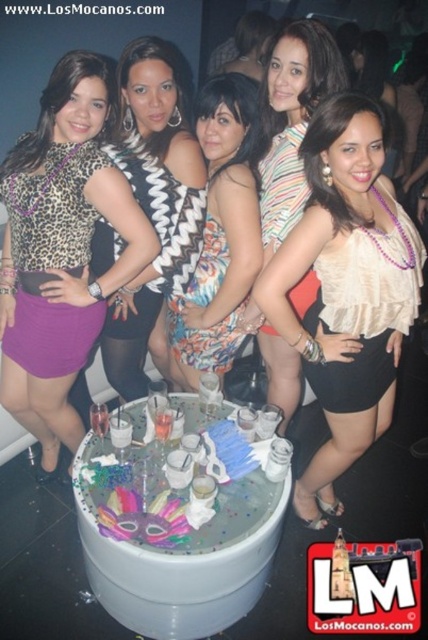
Identify the location of leopard print top at center. (62, 250).

Can you confirm if leopard print top at center is shorter than zigzag fabric dress at center?

No.

Is point (83, 120) closer to camera compared to point (181, 163)?

Yes, point (83, 120) is in front of point (181, 163).

Identify the location of leopard print top at center. (62, 250).

Who is positioned more to the right, white satin blouse at center or leopard print top at center?

Positioned to the right is white satin blouse at center.

Can you confirm if white satin blouse at center is thinner than leopard print top at center?

Yes.

Is point (341, 508) positioned in front of point (109, 170)?

No, it is not.

What are the coordinates of `white satin blouse at center` in the screenshot? It's located at (347, 289).

Is point (330, 99) positioned after point (145, 337)?

No, it is in front of (145, 337).

Who is positioned more to the left, white satin blouse at center or zigzag fabric dress at center?

zigzag fabric dress at center

Find the location of `white satin blouse at center`. white satin blouse at center is located at coordinates (347, 289).

Identify the location of white satin blouse at center. (347, 289).